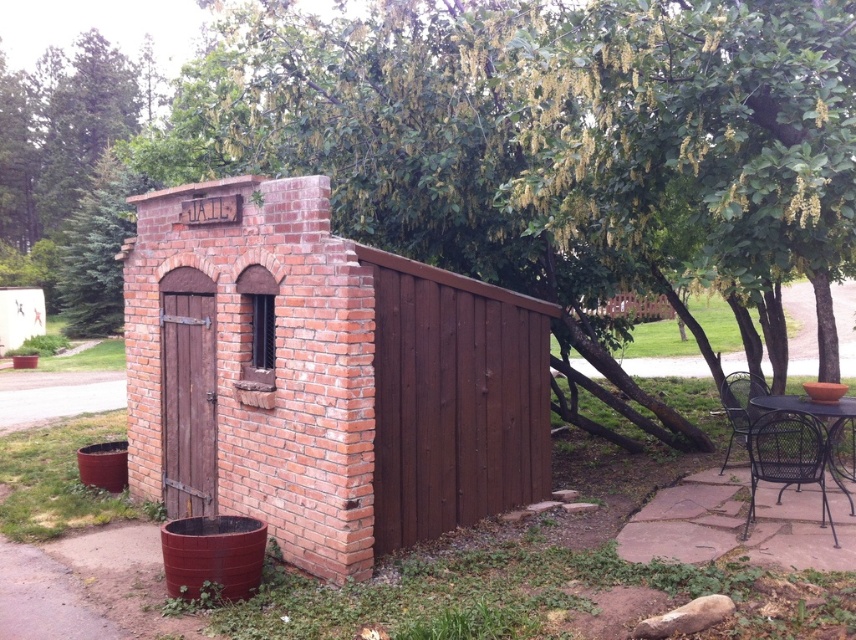
Question: Estimate the real-world distances between objects in this image. Which object is closer to the brick textured hut at center?

Choices:
 (A) rustic wicker chair at lower right
 (B) black wicker table at lower right

Answer: (B)

Question: Considering the relative positions of brick textured hut at center and black wicker table at lower right in the image provided, where is brick textured hut at center located with respect to black wicker table at lower right?

Choices:
 (A) right
 (B) left

Answer: (B)

Question: Is rustic wicker chair at lower right thinner than black wicker table at lower right?

Choices:
 (A) yes
 (B) no

Answer: (A)

Question: Is brick textured hut at center bigger than rustic wicker chair at lower right?

Choices:
 (A) no
 (B) yes

Answer: (B)

Question: Which point is closer to the camera?

Choices:
 (A) black wicker table at lower right
 (B) rustic wicker chair at lower right
 (C) brick textured hut at center

Answer: (C)

Question: Among these objects, which one is farthest from the camera?

Choices:
 (A) black wicker table at lower right
 (B) rustic wicker chair at lower right
 (C) brick textured hut at center

Answer: (B)